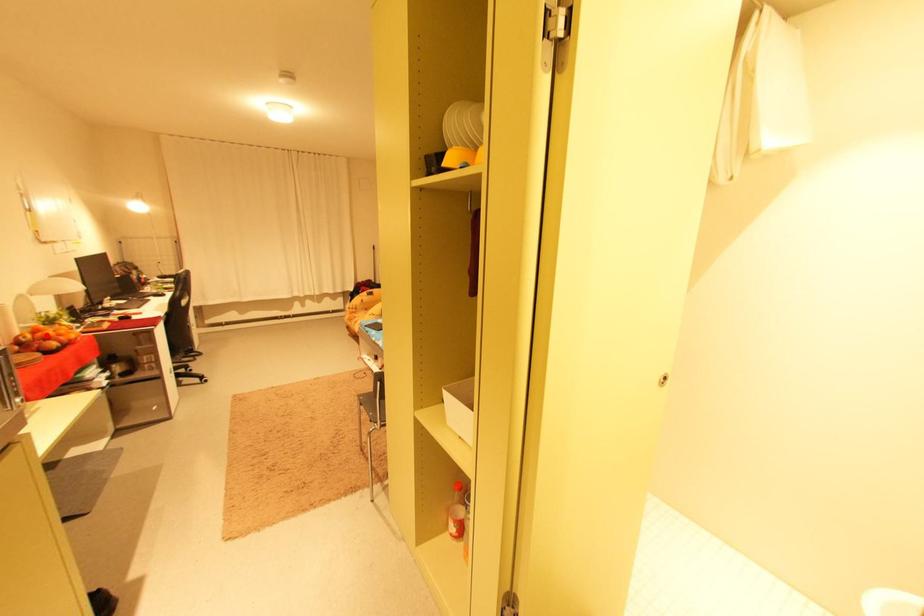
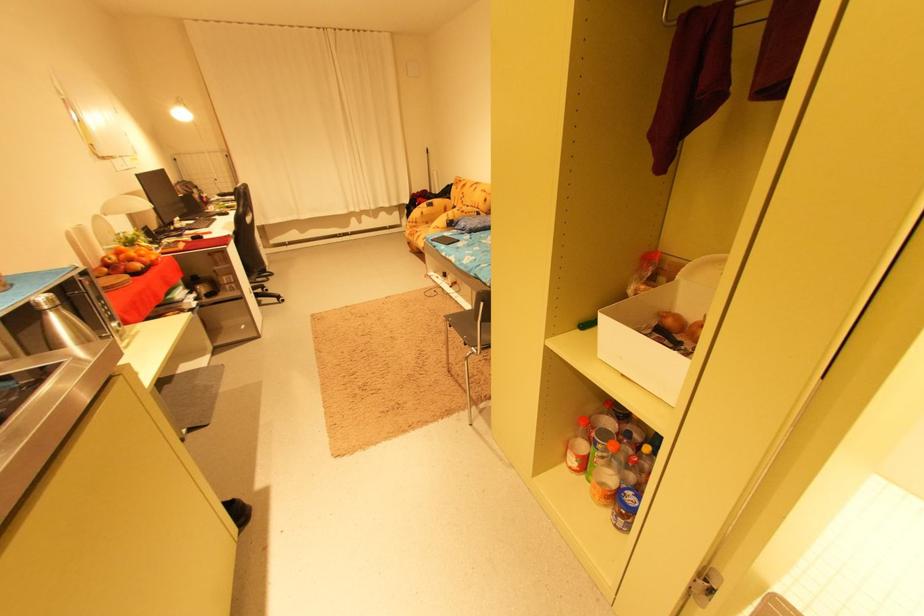
Question: I am providing you with two images of the same scene from different viewpoints. Image1 has a red point marked. In image2, the corresponding 3D location appears at what relative position? Reply with the corresponding letter.

Choices:
 (A) Closer
 (B) Farther

Answer: (A)